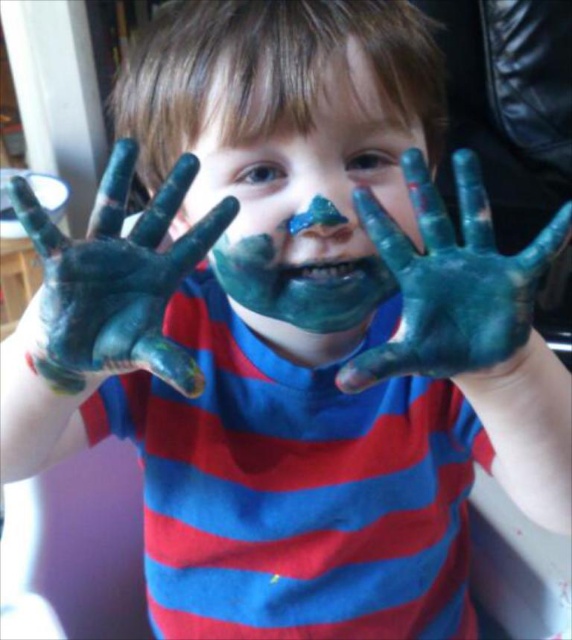
Who is taller, blue matte paint at center or blue matte hands at center?

blue matte paint at center is taller.

Which is more to the right, blue matte paint at center or blue matte hands at center?

From the viewer's perspective, blue matte hands at center appears more on the right side.

Between point (27, 225) and point (463, 209), which one is positioned behind?

Point (463, 209)

This screenshot has width=572, height=640. I want to click on blue matte paint at center, so click(117, 278).

Who is higher up, matte blue paint at center or blue matte hands at center?

matte blue paint at center is above.

Does matte blue paint at center have a smaller size compared to blue matte hands at center?

Incorrect, matte blue paint at center is not smaller in size than blue matte hands at center.

Identify the location of matte blue paint at center. (311, 202).

Who is positioned more to the left, matte blue paint at center or blue matte paint at center?

From the viewer's perspective, blue matte paint at center appears more on the left side.

Does point (217, 196) come behind point (232, 220)?

Yes, it is behind point (232, 220).

The image size is (572, 640). What do you see at coordinates (311, 202) in the screenshot?
I see `matte blue paint at center` at bounding box center [311, 202].

Locate an element on the screen. matte blue paint at center is located at coordinates (311, 202).